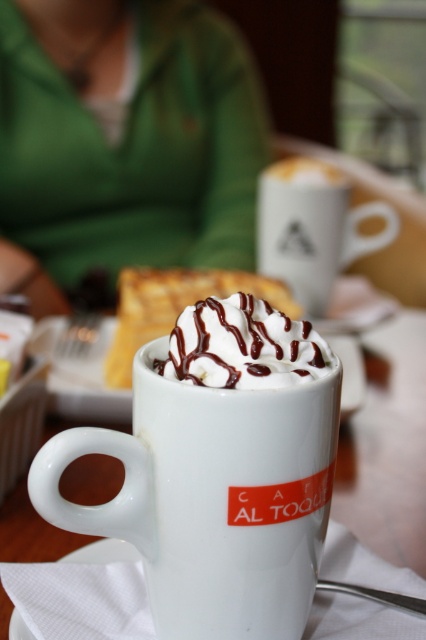
Is point (284, 449) in front of point (230, 323)?

Yes, point (284, 449) is closer to viewer.

What do you see at coordinates (212, 499) in the screenshot?
I see `white ceramic mug at center` at bounding box center [212, 499].

Does point (42, 465) come in front of point (261, 323)?

Yes, it is.

Locate an element on the screen. white ceramic mug at center is located at coordinates (212, 499).

In the scene shown: Does white matte mug at center come behind whipped cream at center?

Yes.

Image resolution: width=426 pixels, height=640 pixels. In order to click on white matte mug at center in this screenshot , I will do `click(313, 227)`.

Find the location of `white matte mug at center`. white matte mug at center is located at coordinates (313, 227).

You are a GUI agent. You are given a task and a screenshot of the screen. Output one action in this format:
    pyautogui.click(x=<x>, y=<y>)
    Task: Click on the white matte mug at center
    
    Given the screenshot: What is the action you would take?
    pyautogui.click(x=313, y=227)

Who is lower down, green fabric at upper center or white matte mug at center?

Positioned lower is white matte mug at center.

Is green fabric at upper center to the left of white matte mug at center from the viewer's perspective?

Correct, you'll find green fabric at upper center to the left of white matte mug at center.

Between point (42, 13) and point (348, 252), which one is positioned behind?

Point (42, 13)

Where is `green fabric at upper center`? This screenshot has width=426, height=640. green fabric at upper center is located at coordinates (123, 140).